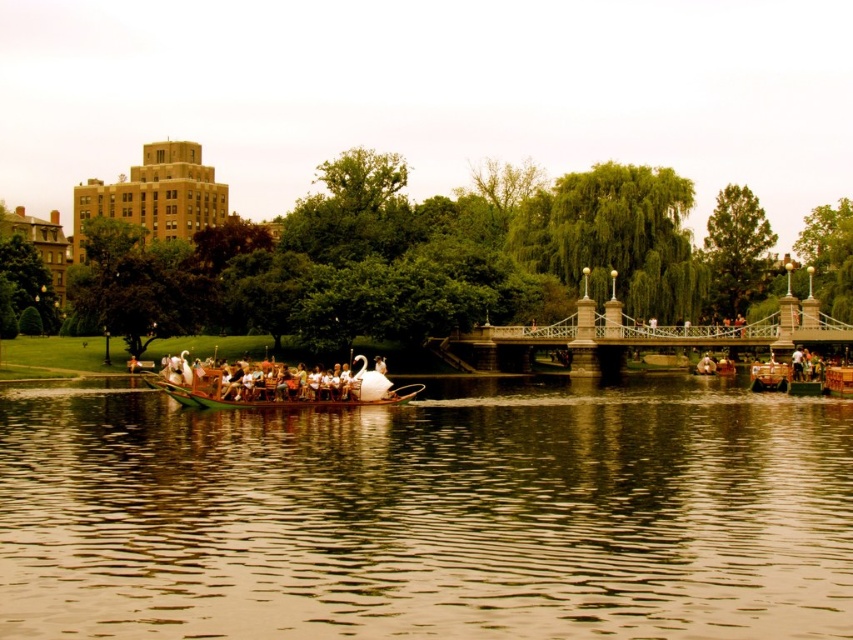
You are a photographer planning to capture the entire wooden boat at center and the brown reflective water at center in one frame. Given that your camera has a fixed focal length, which object should you position closer to the center of the frame to ensure both are fully visible?

The wooden boat at center should be positioned closer to the center of the frame since the brown reflective water at center is wider than the wooden boat at center, allowing more space to accommodate its greater width.

You are planning to take a photo of the wooden boat at center from the shore. The brown reflective water at center might reflect the boat. Considering their sizes, which one would appear bigger in the photo?

The brown reflective water at center has a larger size compared to the wooden boat at center, so the water would appear bigger in the photo.

You are a photographer standing at the edge of the water. You want to capture a clear photo of the wooden boat at center without any reflections from the brown reflective water at center. Is it possible to do so?

The brown reflective water at center is positioned under the wooden boat at center, so it is possible to capture a clear photo of the wooden boat at center without reflections by angling the camera to avoid the reflective surface below it.